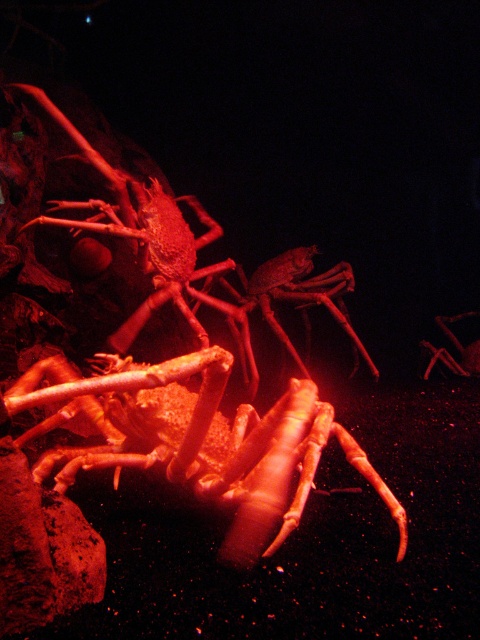
You are observing the crabs in the image and need to determine which of the two points, point [276,474] or point [169,253], is closer to you. Based on the scene description, which point is nearer?

Point [276,474] is closer to the viewer than point [169,253].

In the scene shown: You are a marine biologist observing two lobsters in an aquarium. The lobsters are a matte orange lobster at center and a smooth red lobster at center. You need to place a feeding dish between them. What is the minimum distance the feeding dish should be placed from each lobster to ensure it is exactly between them?

The minimum distance the feeding dish should be placed from each lobster is 0.76 meters, as the distance between the matte orange lobster at center and the smooth red lobster at center is 1.52 meters. Dividing this distance by two gives 0.76 meters, ensuring the dish is exactly in the middle.

You are a marine biologist observing two lobsters in an aquarium. You notice a matte orange lobster at center and a smooth red lobster at center. Which lobster has a greater width?

The matte orange lobster at center has a greater width than the smooth red lobster at center.